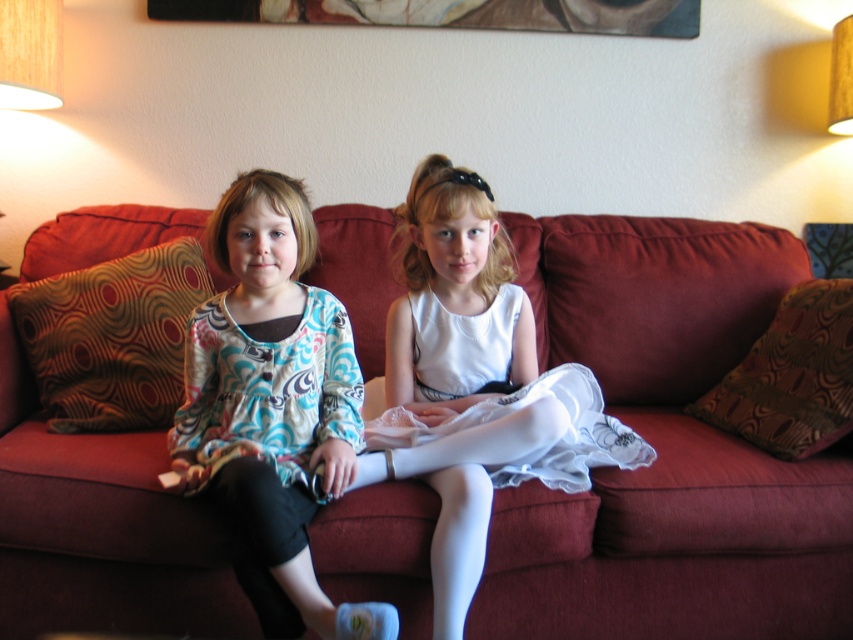
Between point (305, 225) and point (463, 22), which one is positioned behind?

The point (463, 22) is behind.

Does matte blue-patterned shirt at center have a greater width compared to wooden picture frame at upper center?

No.

Where is `matte blue-patterned shirt at center`? The height and width of the screenshot is (640, 853). matte blue-patterned shirt at center is located at coordinates (273, 406).

Is point (257, 262) less distant than point (486, 208)?

Yes, it is.

The height and width of the screenshot is (640, 853). What are the coordinates of `matte blue-patterned shirt at center` in the screenshot? It's located at (273, 406).

Is velvet red couch at center below white lace dress at center?

No.

Can you confirm if velvet red couch at center is taller than white lace dress at center?

Indeed, velvet red couch at center has a greater height compared to white lace dress at center.

In the scene shown: Measure the distance between point (3, 548) and camera.

1.50 meters

At what (x,y) coordinates should I click in order to perform the action: click on velvet red couch at center. Please return your answer as a coordinate pair (x, y). This screenshot has height=640, width=853. Looking at the image, I should click on (666, 449).